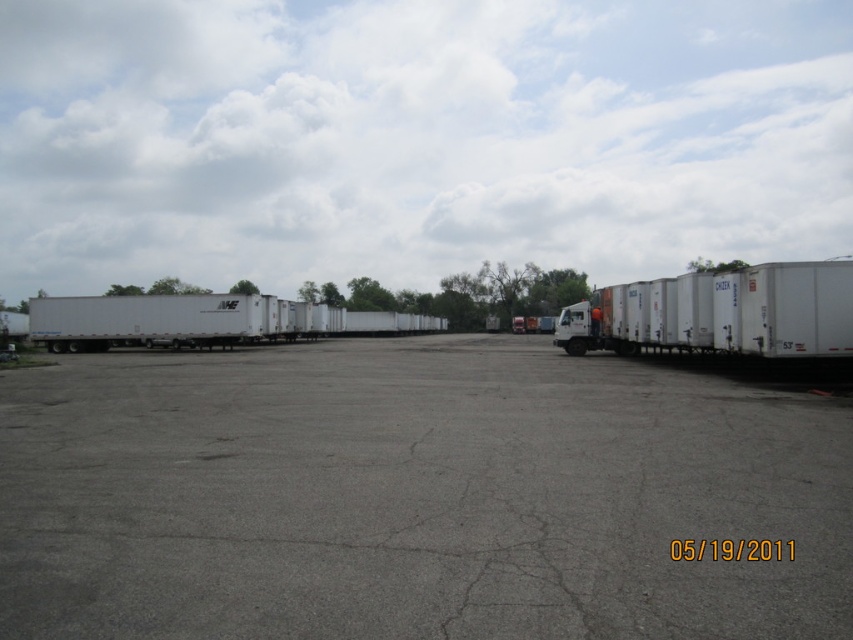
Question: Can you confirm if white matte trailer truck at right is bigger than white matte trailer at left?

Choices:
 (A) yes
 (B) no

Answer: (B)

Question: Is gray asphalt parking lot at center positioned at the back of white matte trailer at left?

Choices:
 (A) no
 (B) yes

Answer: (A)

Question: Estimate the real-world distances between objects in this image. Which object is farther from the white matte trailer at left?

Choices:
 (A) white matte trailer truck at right
 (B) gray asphalt parking lot at center

Answer: (B)

Question: Is gray asphalt parking lot at center further to the viewer compared to white matte trailer at left?

Choices:
 (A) no
 (B) yes

Answer: (A)

Question: Which point is closer to the camera?

Choices:
 (A) (45, 310)
 (B) (677, 337)

Answer: (B)

Question: Which of these objects is positioned closest to the gray asphalt parking lot at center?

Choices:
 (A) white matte trailer at left
 (B) white matte trailer truck at right

Answer: (B)